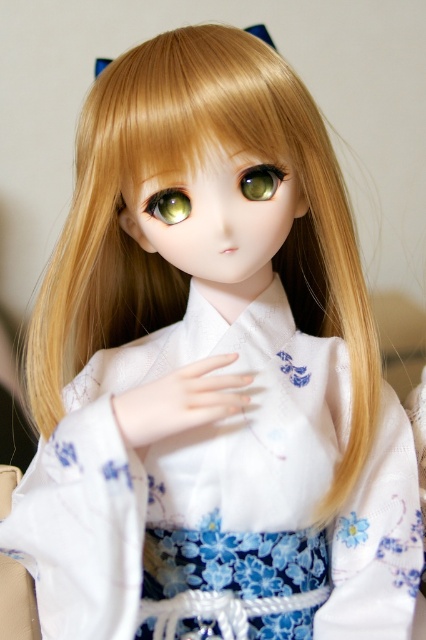
Where is `green matte eye at center`? Image resolution: width=426 pixels, height=640 pixels. green matte eye at center is located at coordinates (261, 180).

Is green matte eye at center to the right of green glossy eye at center from the viewer's perspective?

Yes, green matte eye at center is to the right of green glossy eye at center.

Image resolution: width=426 pixels, height=640 pixels. What do you see at coordinates (261, 180) in the screenshot?
I see `green matte eye at center` at bounding box center [261, 180].

Locate an element on the screen. This screenshot has height=640, width=426. green matte eye at center is located at coordinates (261, 180).